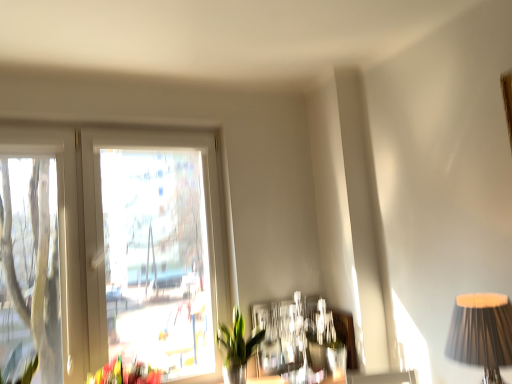
Question: From the image's perspective, is white plastic window at upper left beneath green glossy plant at lower center?

Choices:
 (A) yes
 (B) no

Answer: (B)

Question: Is white plastic window at upper left positioned before green glossy plant at lower center?

Choices:
 (A) no
 (B) yes

Answer: (B)

Question: Does white plastic window at upper left have a greater height compared to green glossy plant at lower center?

Choices:
 (A) no
 (B) yes

Answer: (B)

Question: Considering the relative sizes of white plastic window at upper left and green glossy plant at lower center in the image provided, is white plastic window at upper left wider than green glossy plant at lower center?

Choices:
 (A) no
 (B) yes

Answer: (A)

Question: From a real-world perspective, is white plastic window at upper left located beneath green glossy plant at lower center?

Choices:
 (A) yes
 (B) no

Answer: (B)

Question: Is white plastic window at upper left at the right side of green glossy plant at lower center?

Choices:
 (A) no
 (B) yes

Answer: (A)

Question: Does green leafy plant at left lie behind black pleated fabric lampshade at right?

Choices:
 (A) yes
 (B) no

Answer: (A)

Question: Can you confirm if green leafy plant at left is bigger than black pleated fabric lampshade at right?

Choices:
 (A) no
 (B) yes

Answer: (A)

Question: Considering the relative sizes of green leafy plant at left and black pleated fabric lampshade at right in the image provided, is green leafy plant at left shorter than black pleated fabric lampshade at right?

Choices:
 (A) no
 (B) yes

Answer: (B)

Question: Can you confirm if green leafy plant at left is taller than black pleated fabric lampshade at right?

Choices:
 (A) yes
 (B) no

Answer: (B)

Question: Does green leafy plant at left have a lesser width compared to black pleated fabric lampshade at right?

Choices:
 (A) no
 (B) yes

Answer: (A)

Question: From a real-world perspective, does green leafy plant at left stand above black pleated fabric lampshade at right?

Choices:
 (A) yes
 (B) no

Answer: (A)

Question: Can you confirm if green leafy plant at left is positioned to the left of green glossy plant at lower center?

Choices:
 (A) no
 (B) yes

Answer: (B)